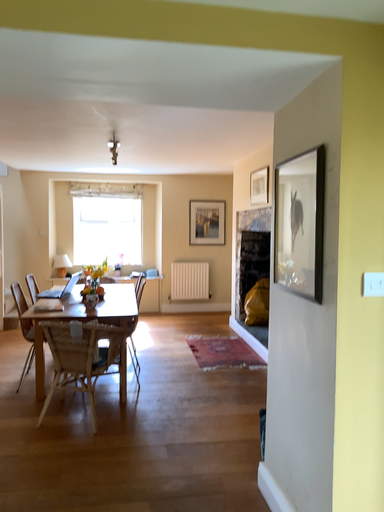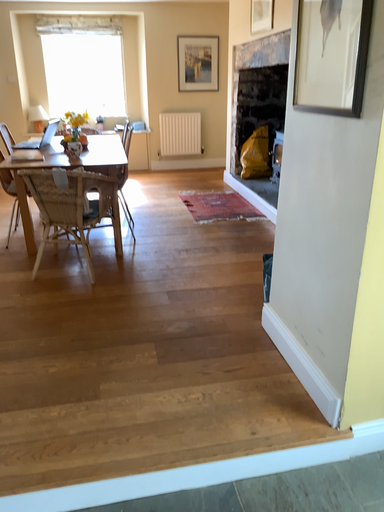
Question: How did the camera likely rotate when shooting the video?

Choices:
 (A) rotated upward
 (B) rotated downward

Answer: (B)